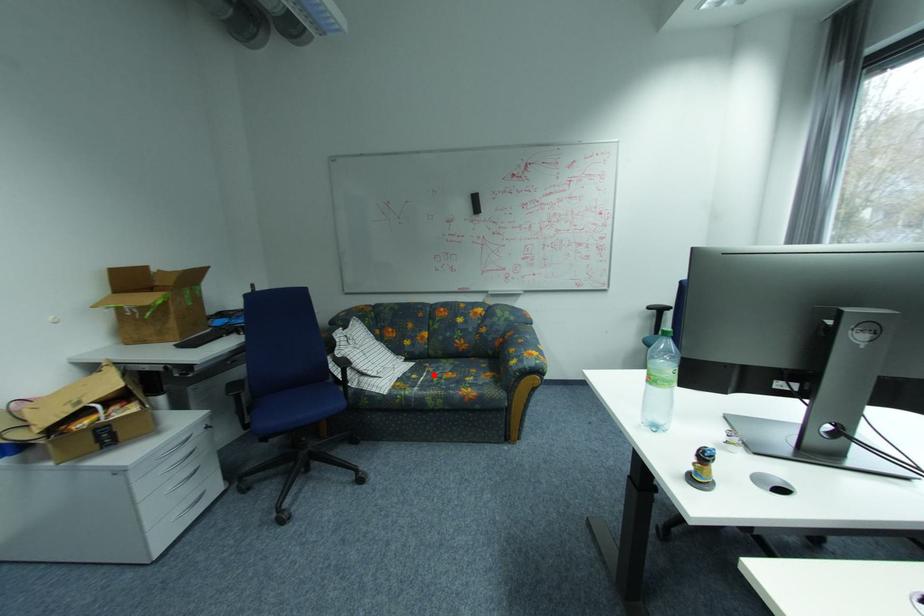
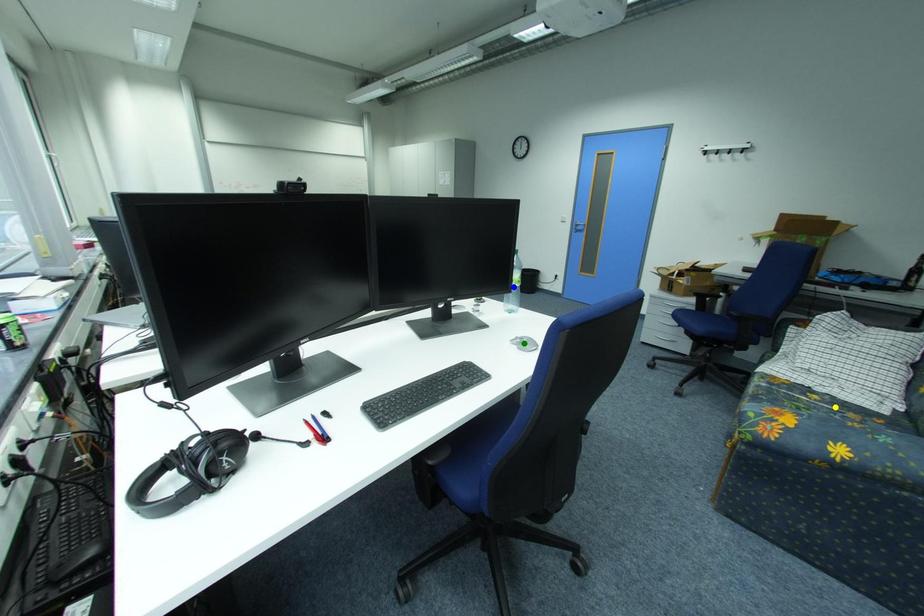
Question: I am providing you with two images of the same scene from different viewpoints. A red point is marked on the first image. You are given multiple points on the second image. Which point in image 2 represents the same 3d spot as the red point in image 1?

Choices:
 (A) yellow point
 (B) blue point
 (C) green point

Answer: (A)